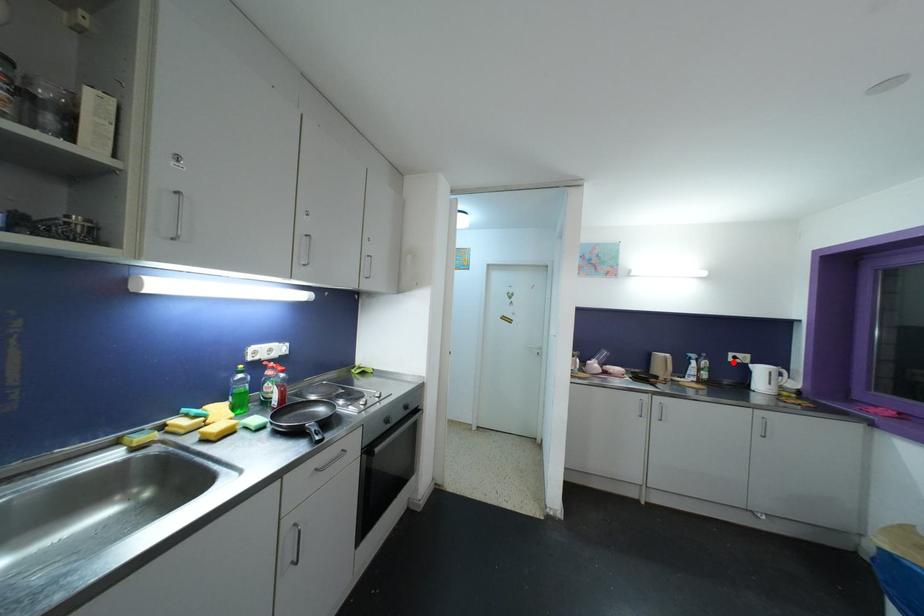
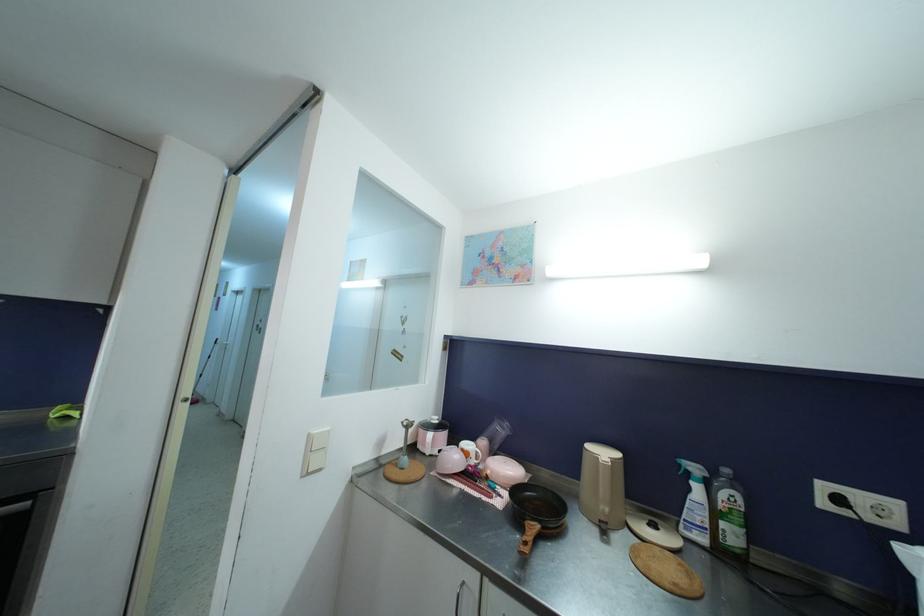
In the second image, find the point that corresponds to the highlighted location in the first image.

(827, 507)